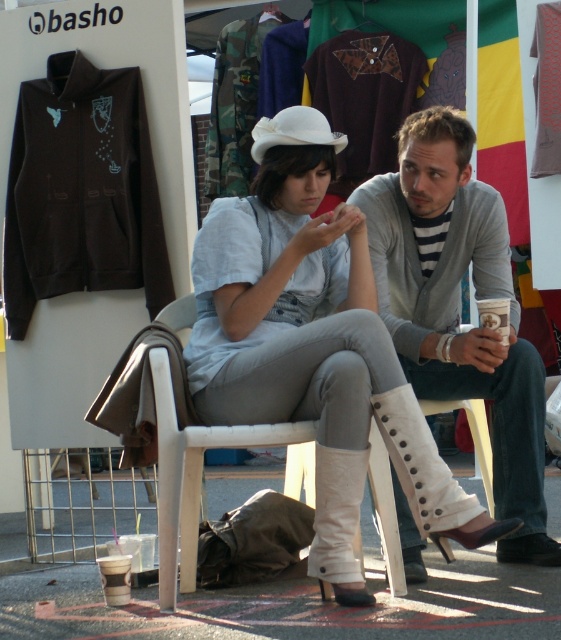
You are a delivery person who needs to drop off a package at the gray knit sweater at center. The package can only be placed at point (459, 307). Is the package placed correctly?

Yes, the package is placed correctly because the gray knit sweater at center is located exactly at point (459, 307).

You are a delivery robot with a 14 inch wide package. You need to place it between the white matte boots at center and the white plastic chair at center. Is there enough space?

The distance between the white matte boots at center and the white plastic chair at center is 13.94 inches. Since the package is 14 inches wide, there is not enough space to place it between them.

You are a delivery person trying to place a small package between the white matte boots at center and the white plastic chair at center. Can you fit the package there?

The white matte boots at center might be wider than white plastic chair at center, so there might not be enough space to fit the package between them.